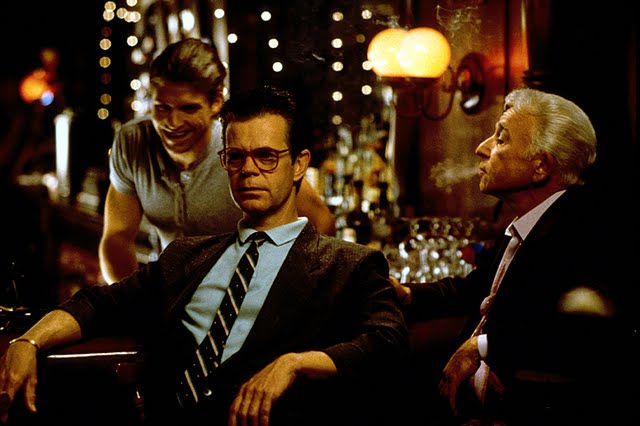
At what (x,y) coordinates should I click in order to perform the action: click on fancy lamp. Please return your answer as a coordinate pair (x, y). Image resolution: width=640 pixels, height=426 pixels. Looking at the image, I should click on (403, 68), (432, 37), (390, 64).